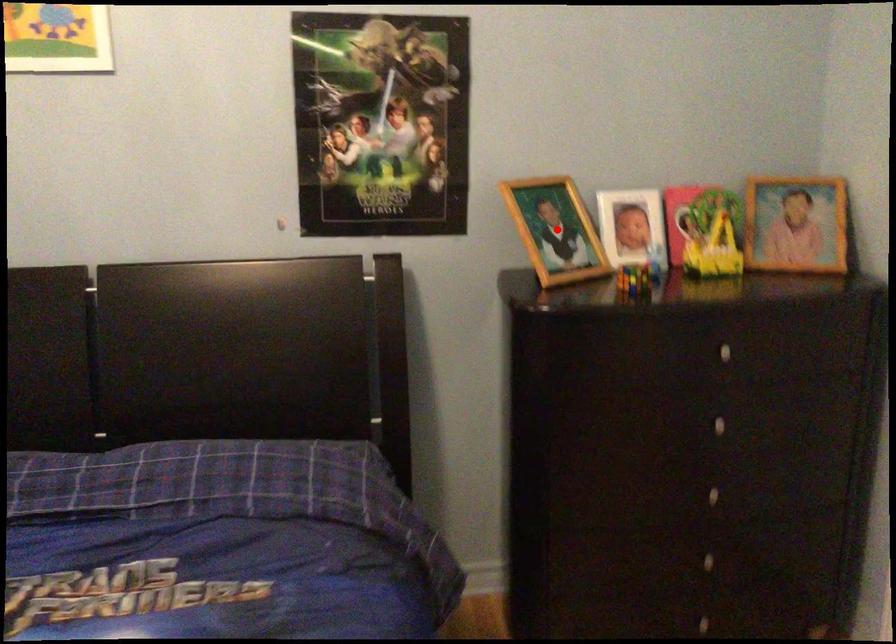
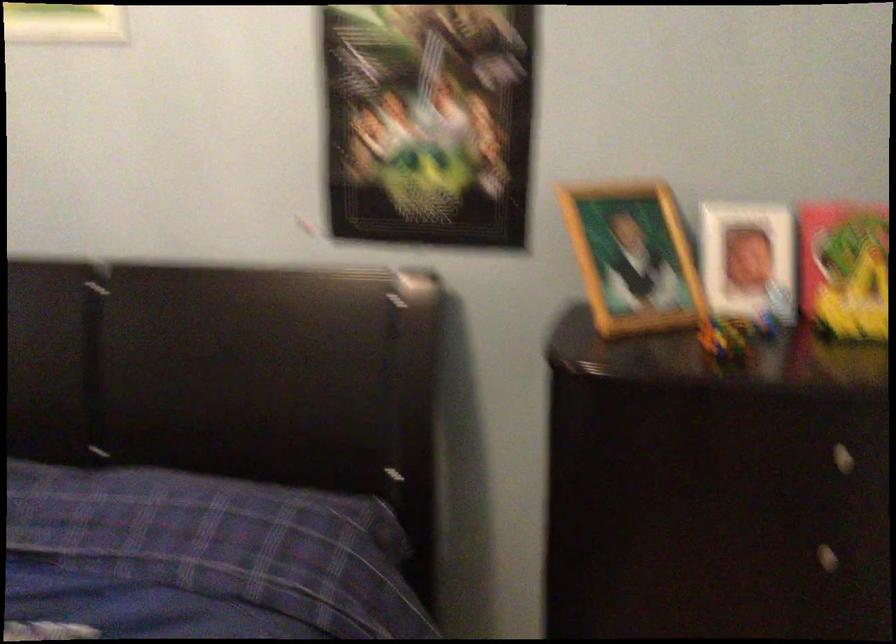
The point at the highlighted location is marked in the first image. Where is the corresponding point in the second image?

(633, 258)